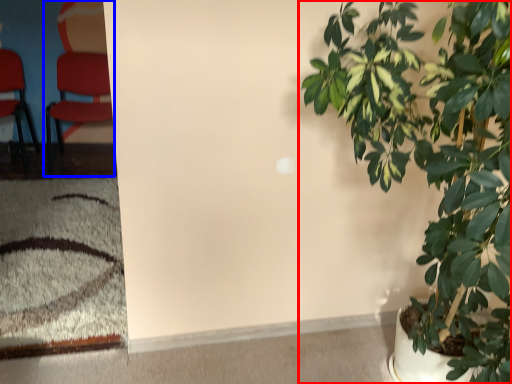
Question: Which object appears closest to the camera in this image, houseplant (highlighted by a red box) or chair (highlighted by a blue box)?

Choices:
 (A) houseplant
 (B) chair

Answer: (A)